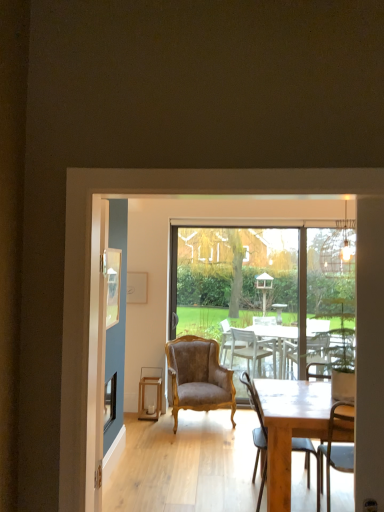
Question: Considering the positions of transparent glass screen door at center and brown velvet armchair at center, the 1th chair viewed from the back, in the image, is transparent glass screen door at center bigger or smaller than brown velvet armchair at center, the 1th chair viewed from the back,?

Choices:
 (A) small
 (B) big

Answer: (A)

Question: From a real-world perspective, is transparent glass screen door at center above or below brown velvet armchair at center, the 2th chair viewed from the right?

Choices:
 (A) below
 (B) above

Answer: (B)

Question: Which object is the farthest from the wooden chair at center, which is counted as the second chair, starting from the left?

Choices:
 (A) transparent glass screen door at center
 (B) wooden picture frame at upper left
 (C) wooden stool at center
 (D) wooden table at center
 (E) brown velvet armchair at center, the 1th chair viewed from the back

Answer: (C)

Question: Which of these objects is positioned closest to the wooden chair at center, which is counted as the second chair, starting from the left?

Choices:
 (A) transparent glass screen door at center
 (B) transparent glass window screen at center
 (C) wooden stool at center
 (D) wooden table at center
 (E) brown velvet armchair at center, the 1th chair in the left-to-right sequence

Answer: (D)